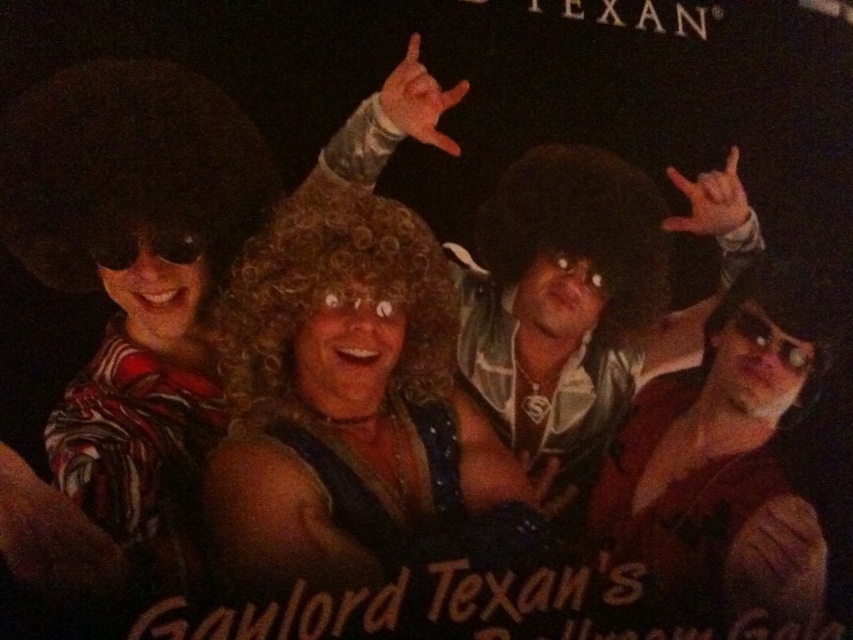
Question: Is curly blonde wig at center above shiny brown leather jacket at right?

Choices:
 (A) yes
 (B) no

Answer: (A)

Question: Is curly blonde wig at center above shiny brown leather jacket at right?

Choices:
 (A) yes
 (B) no

Answer: (A)

Question: Does curly blonde wig at center have a smaller size compared to shiny brown leather jacket at right?

Choices:
 (A) yes
 (B) no

Answer: (B)

Question: Which of the following is the closest to the observer?

Choices:
 (A) curly blonde wig at center
 (B) shiny brown leather jacket at right

Answer: (A)